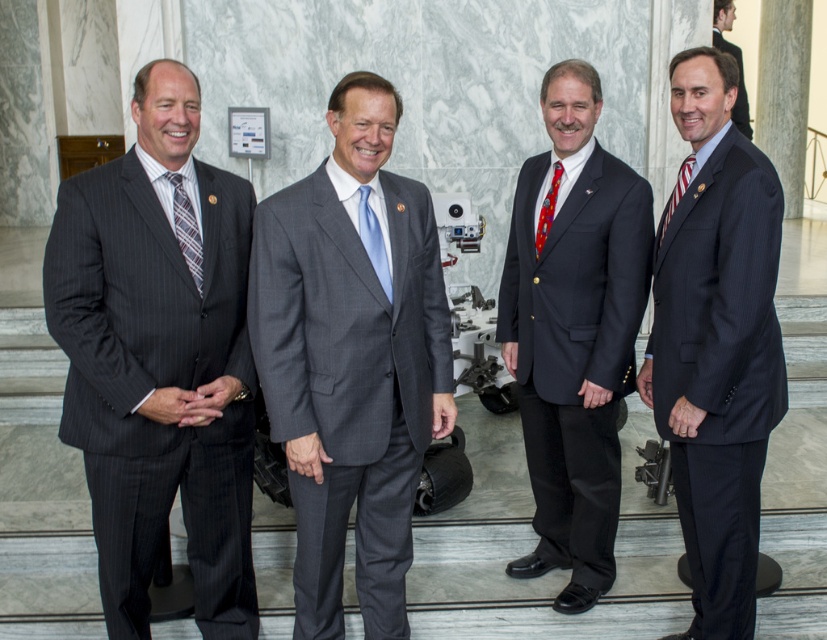
Question: Which point is farther to the camera?

Choices:
 (A) (361, 234)
 (B) (739, 84)
 (C) (682, 176)
 (D) (175, 182)

Answer: (B)

Question: Does plaid silk tie at left appear under matte black suit at center?

Choices:
 (A) no
 (B) yes

Answer: (B)

Question: Considering the real-world distances, which object is farthest from the red satin tie at center?

Choices:
 (A) matte pinstripe suit at left
 (B) matte black suit at center
 (C) plaid silk tie at left

Answer: (B)

Question: Based on their relative distances, which object is nearer to the plaid silk tie at left?

Choices:
 (A) gray pinstripe suit at center
 (B) light blue silk tie at center
 (C) matte black suit at center
 (D) dark blue suit at center

Answer: (B)

Question: Does matte pinstripe suit at left have a smaller size compared to gray pinstripe suit at center?

Choices:
 (A) yes
 (B) no

Answer: (B)

Question: In this image, where is matte pinstripe suit at left located relative to plaid silk tie at left?

Choices:
 (A) left
 (B) right

Answer: (A)